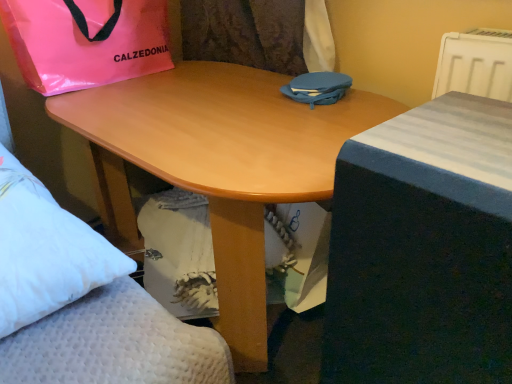
Locate an element on the screen. free point above blue fabric bed at right (from a real-world perspective) is located at coordinates (458, 137).